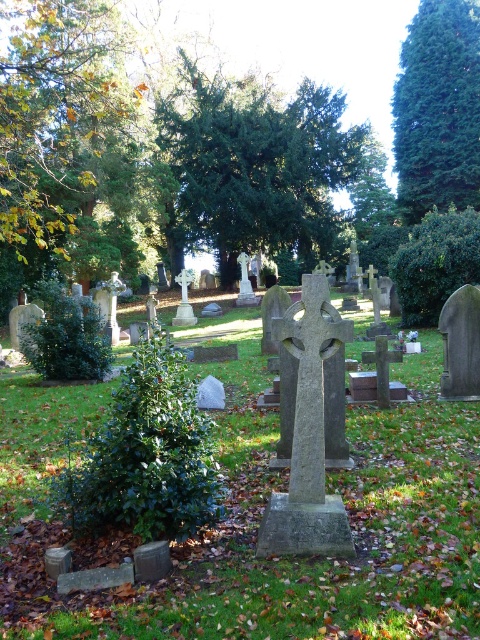
This screenshot has width=480, height=640. What do you see at coordinates (259, 164) in the screenshot? I see `green leafy tree at center` at bounding box center [259, 164].

Consider the image. Is green leafy tree at center taller than green leafy tree at upper left?

Correct, green leafy tree at center is much taller as green leafy tree at upper left.

Is point (231, 176) behind point (64, 250)?

Yes, point (231, 176) is farther from viewer.

Identify the location of green leafy tree at center. (259, 164).

Is point (189, 188) positioned in front of point (462, 113)?

No, it is behind (462, 113).

Who is positioned more to the left, green leafy tree at center or green textured tree at upper right?

green leafy tree at center is more to the left.

Identify the location of green leafy tree at center. The height and width of the screenshot is (640, 480). (259, 164).

The image size is (480, 640). I want to click on green leafy tree at center, so click(259, 164).

From the picture: Which is above, green grassy at center or green textured tree at upper right?

green textured tree at upper right is higher up.

Is point (249, 616) positioned behind point (424, 140)?

No, it is in front of (424, 140).

Where is `green grassy at center`? This screenshot has height=640, width=480. green grassy at center is located at coordinates (259, 522).